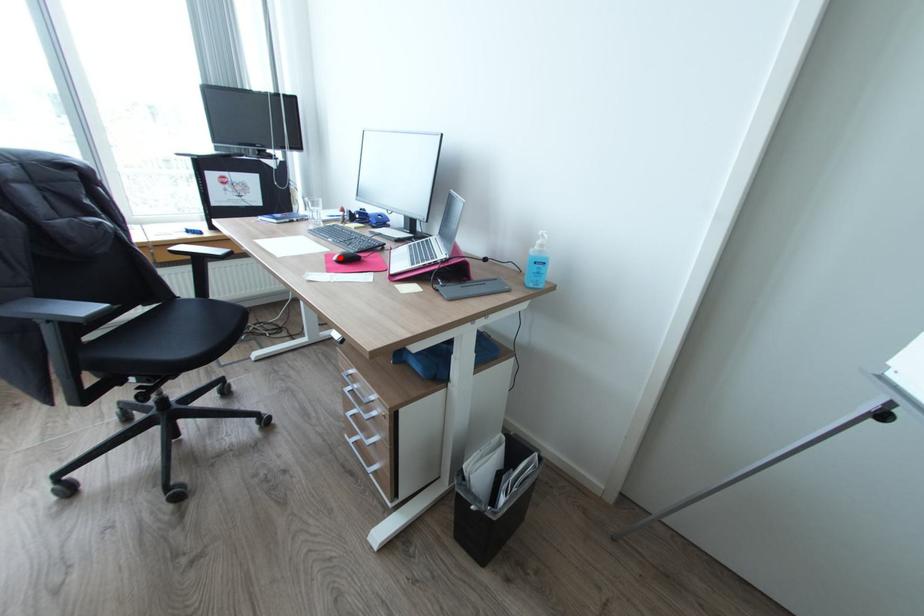
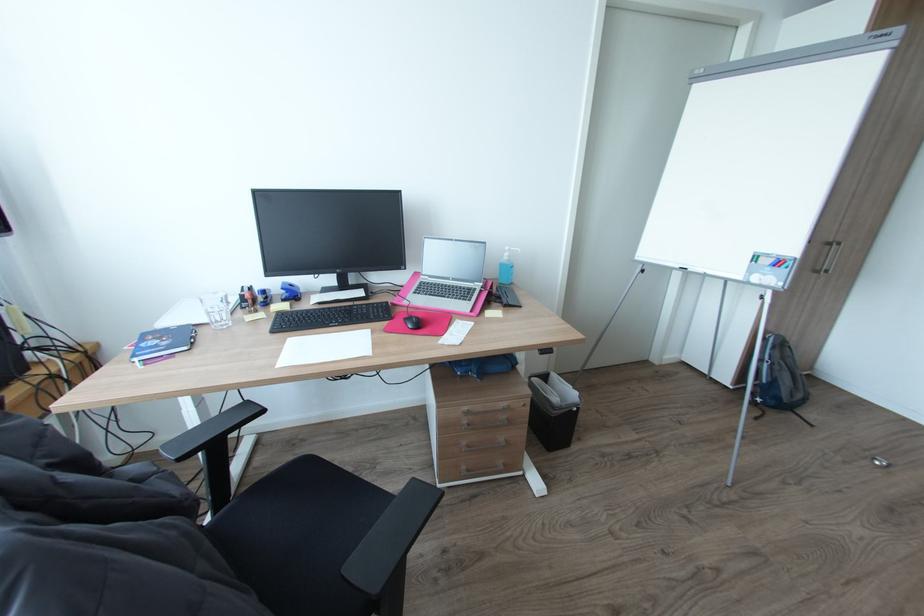
Where in the second image is the point corresponding to the highlighted location from the first image?

(417, 326)